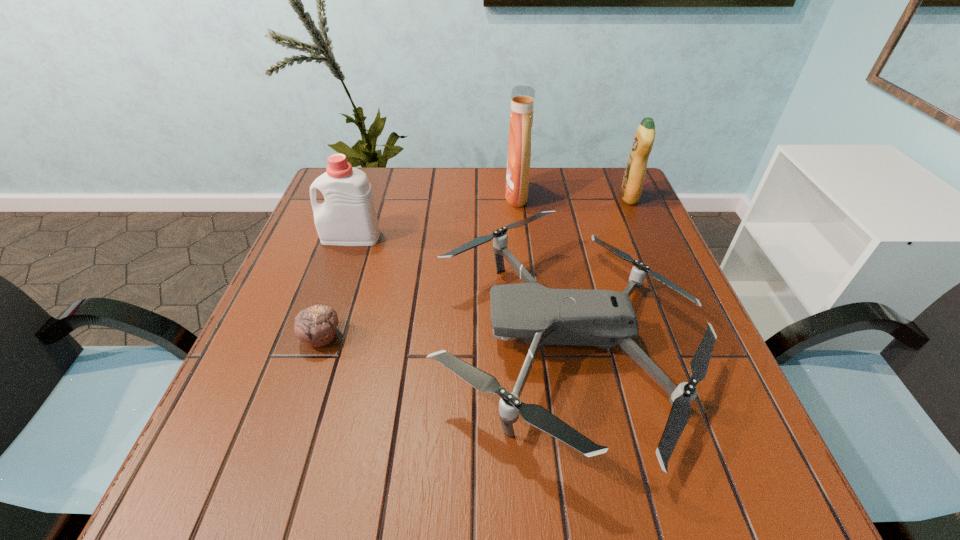
At what (x,y) coordinates should I click in order to perform the action: click on vacant area located on the label of the rightmost detergent. Please return your answer as a coordinate pair (x, y). This screenshot has height=540, width=960. Looking at the image, I should click on (555, 197).

Identify the location of free space located on the label of the rightmost detergent. (509, 197).

What are the coordinates of `vacant space located 0.050m on the label of the rightmost detergent` in the screenshot? It's located at click(x=602, y=197).

What are the coordinates of `vacant area situated 0.220m on the front-facing side of the drone` in the screenshot? It's located at (323, 340).

This screenshot has height=540, width=960. Identify the location of vacant region located on the front-facing side of the drone. (400, 340).

This screenshot has width=960, height=540. What are the coordinates of `vacant space situated on the front-facing side of the drone` in the screenshot? It's located at (267, 340).

Locate an element on the screen. vacant space situated on the right of the shortest object is located at coordinates (515, 338).

At what (x,y) coordinates should I click in order to perform the action: click on object present at the near edge. Please return your answer as a coordinate pair (x, y). This screenshot has width=960, height=540. Looking at the image, I should click on tap(604, 318).

Image resolution: width=960 pixels, height=540 pixels. In order to click on detergent that is at the left edge in this screenshot , I will do [x=348, y=217].

Where is `muffin at the left edge`? This screenshot has height=540, width=960. muffin at the left edge is located at coordinates (316, 326).